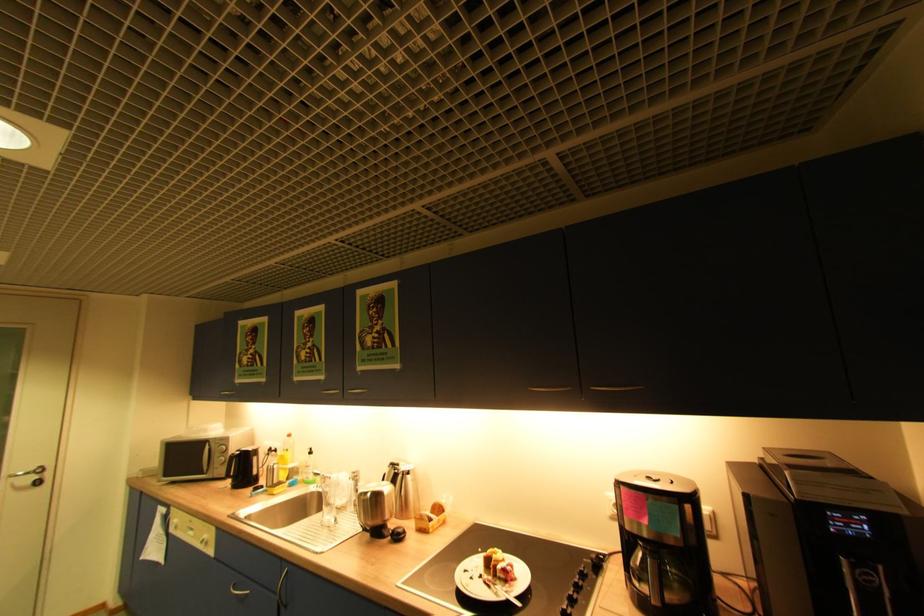
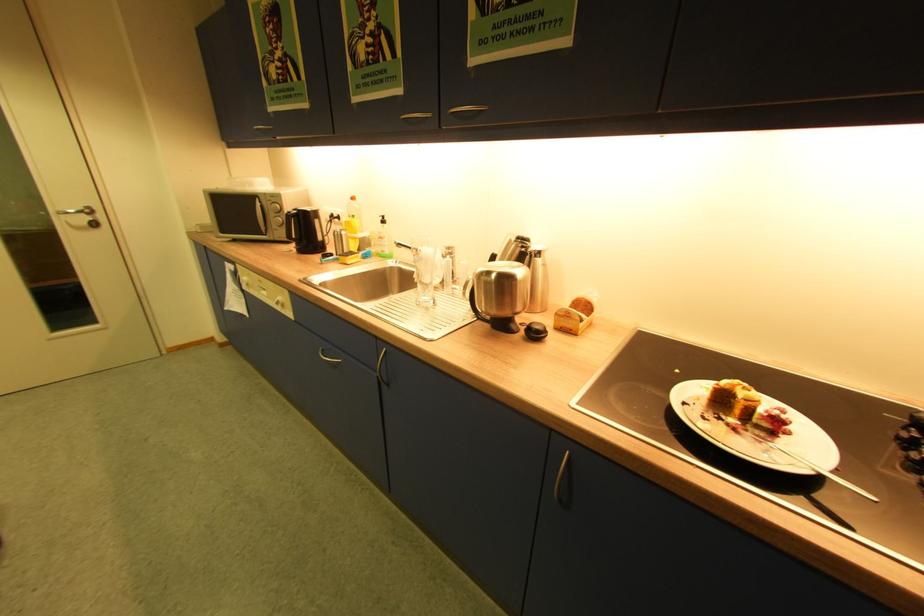
The point at (334, 507) is marked in the first image. Where is the corresponding point in the second image?

(427, 284)